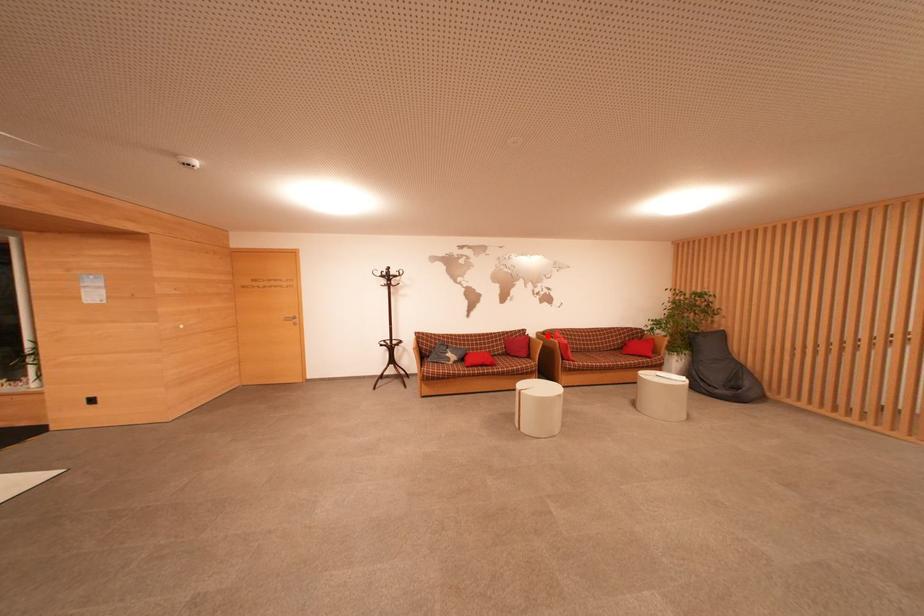
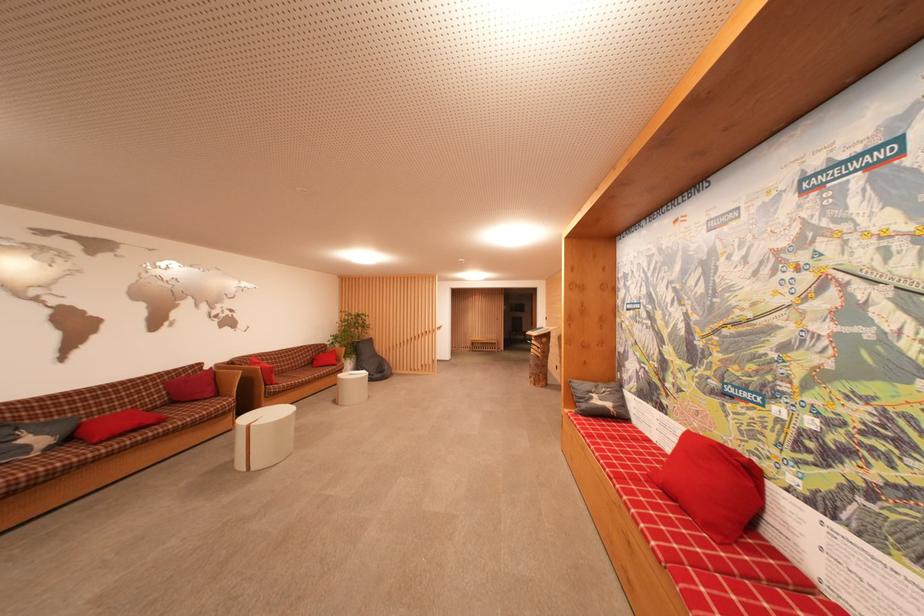
Find the pixel in the second image that matches the highlighted location in the first image.

(235, 366)